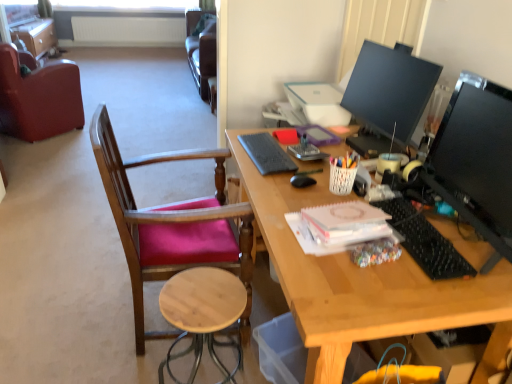
The height and width of the screenshot is (384, 512). In order to click on free spot below gray matte keyboard at center, which appears as the second notepad when ordered from the bottom (from a real-world perspective) in this screenshot , I will do `click(261, 289)`.